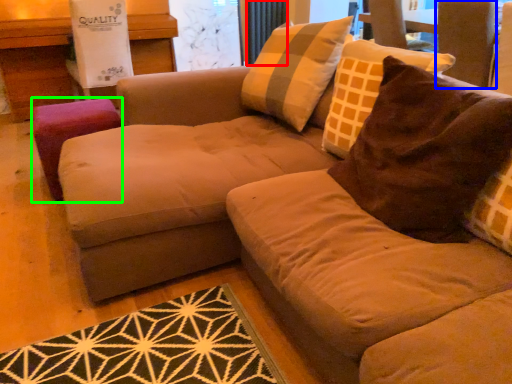
Question: Which is farther away from curtain (highlighted by a red box)? swivel chair (highlighted by a blue box) or stool (highlighted by a green box)?

Choices:
 (A) swivel chair
 (B) stool

Answer: (B)